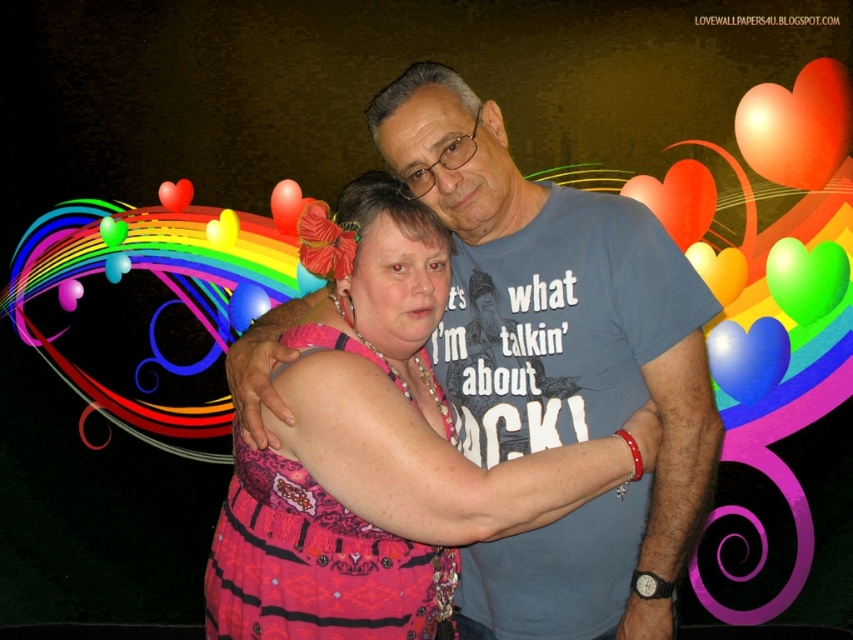
Question: Which of the following is the farthest from the observer?

Choices:
 (A) (740, 358)
 (B) (108, 278)

Answer: (B)

Question: Which of the following is the closest to the observer?

Choices:
 (A) shiny red heart at upper right
 (B) green matte heart at upper right
 (C) translucent pink balloon at upper left

Answer: (A)

Question: Where is blue glossy balloon at upper right located in relation to pink rubber balloon at center in the image?

Choices:
 (A) below
 (B) above

Answer: (A)

Question: Does shiny red heart at upper right have a smaller size compared to rubber balloon at center?

Choices:
 (A) yes
 (B) no

Answer: (B)

Question: Does blue glossy balloon at upper right appear under rubber heart at upper left?

Choices:
 (A) no
 (B) yes

Answer: (B)

Question: Which object is closer to the camera taking this photo?

Choices:
 (A) green matte heart at upper right
 (B) green glossy balloon at upper right
 (C) rubber heart at upper left

Answer: (A)